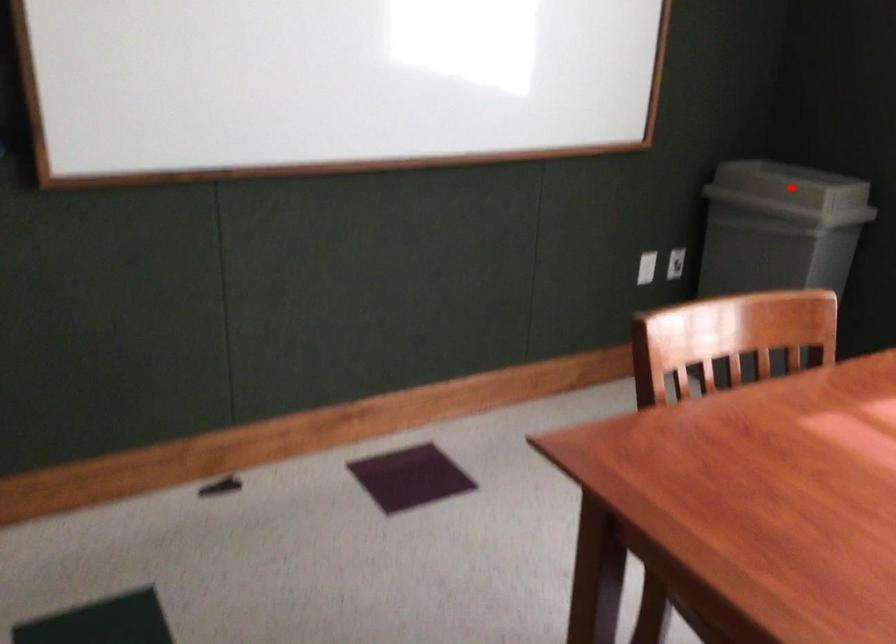
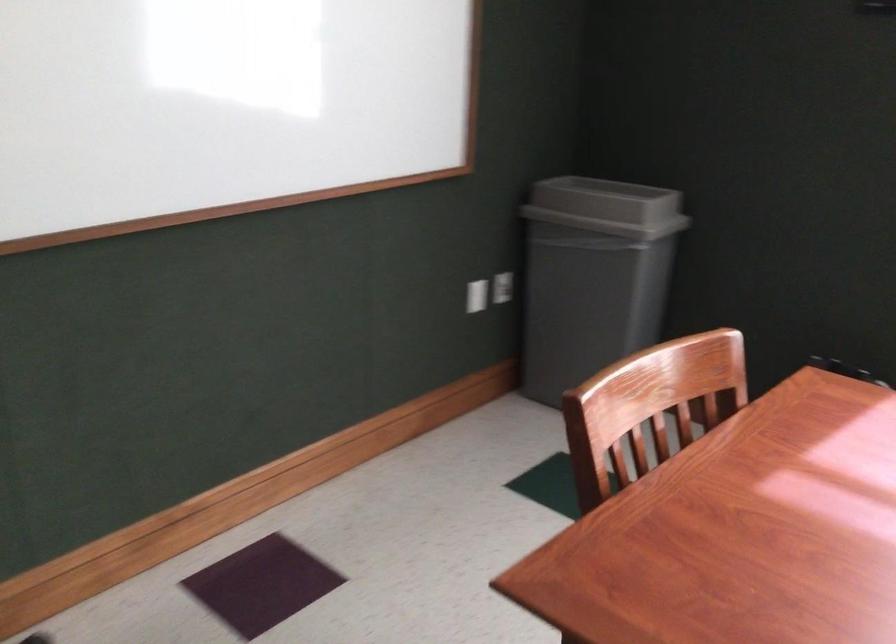
In the second image, find the point that corresponds to the highlighted location in the first image.

(607, 207)